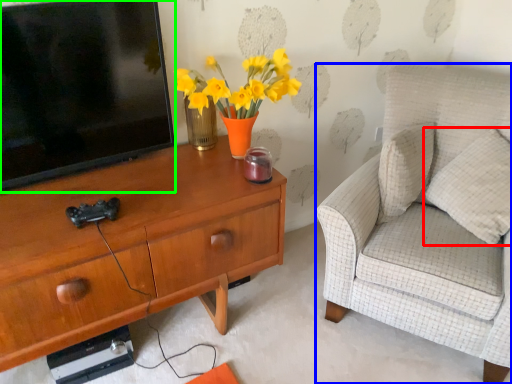
Question: Based on their relative distances, which object is nearer to pillow (highlighted by a red box)? Choose from chair (highlighted by a blue box) and television (highlighted by a green box).

Choices:
 (A) chair
 (B) television

Answer: (A)